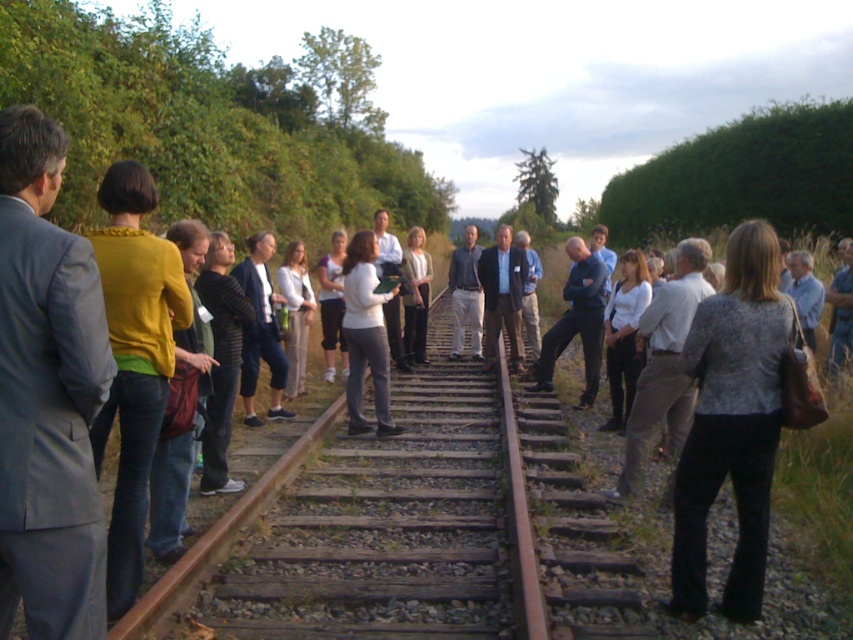
From the picture: You are a photographer trying to capture a group photo of the people near the railway tracks. You want to ensure that both the patterned fabric jacket at center and the dark blue shirt at center are clearly visible in the photo. Given their sizes, which clothing item should you focus on to ensure it fits within the frame without cropping?

The patterned fabric jacket at center is narrower than the dark blue shirt at center, so focusing on the dark blue shirt at center ensures it fits within the frame without cropping since it is wider.

You are standing at the bottom left corner of the image and want to walk towards the patterned fabric jacket at center. Which direction should you move relative to the railway tracks?

The patterned fabric jacket at center is located at point (732,422), so you should move diagonally towards the center of the image along the railway tracks to reach it.